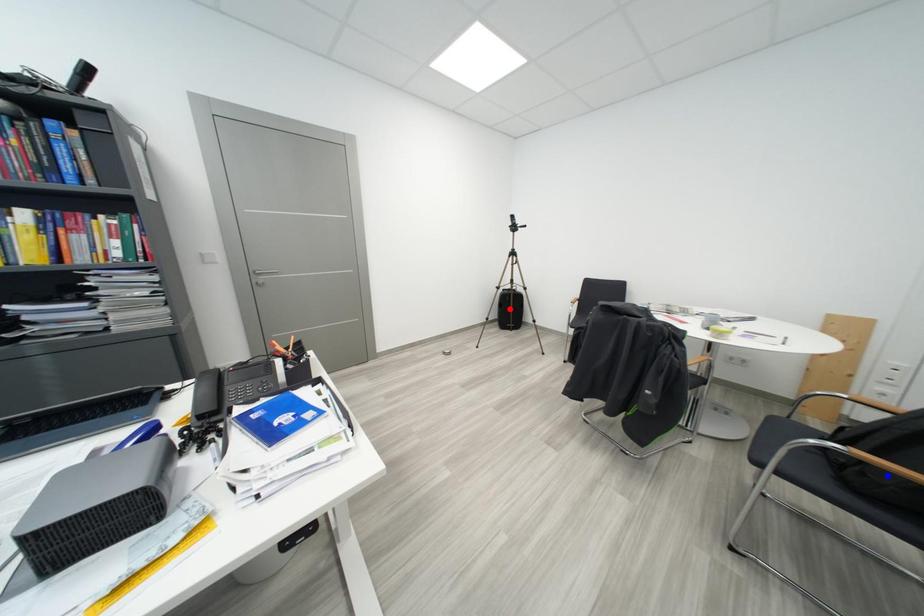
Question: Which of the two points in the image is closer to the camera?

Choices:
 (A) Blue point is closer.
 (B) Red point is closer.

Answer: (A)